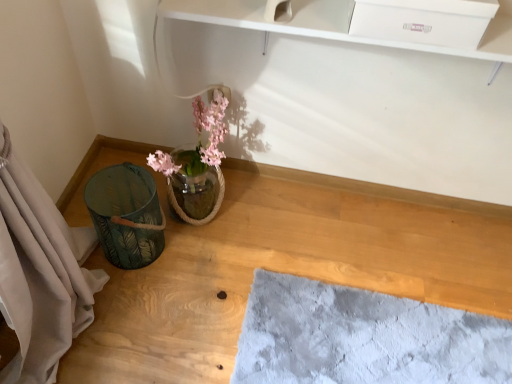
You are a GUI agent. You are given a task and a screenshot of the screen. Output one action in this format:
    pyautogui.click(x=<x>, y=<y>)
    Task: Click on the free space in front of green leaf-patterned basket at left
    The height and width of the screenshot is (384, 512).
    Given the screenshot: What is the action you would take?
    pyautogui.click(x=132, y=305)